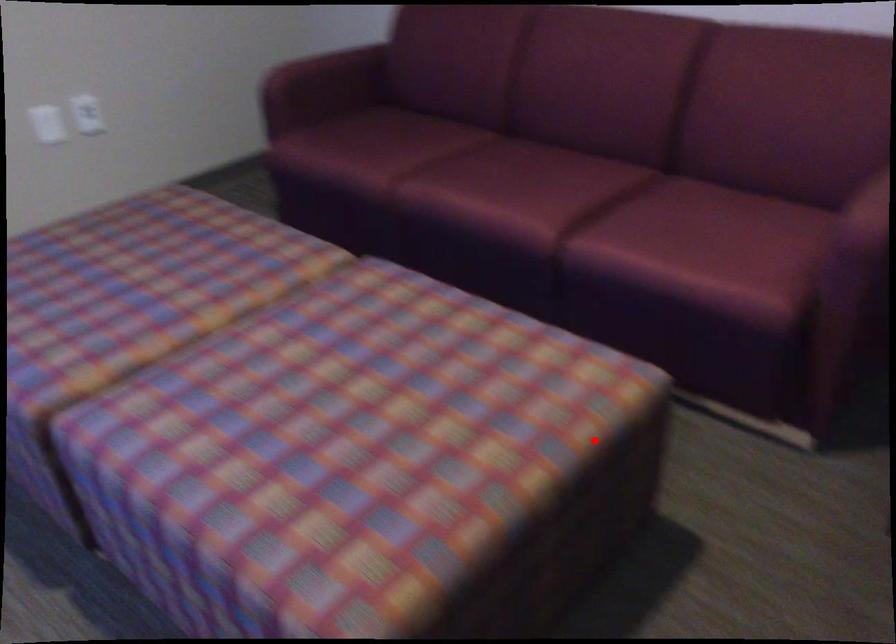
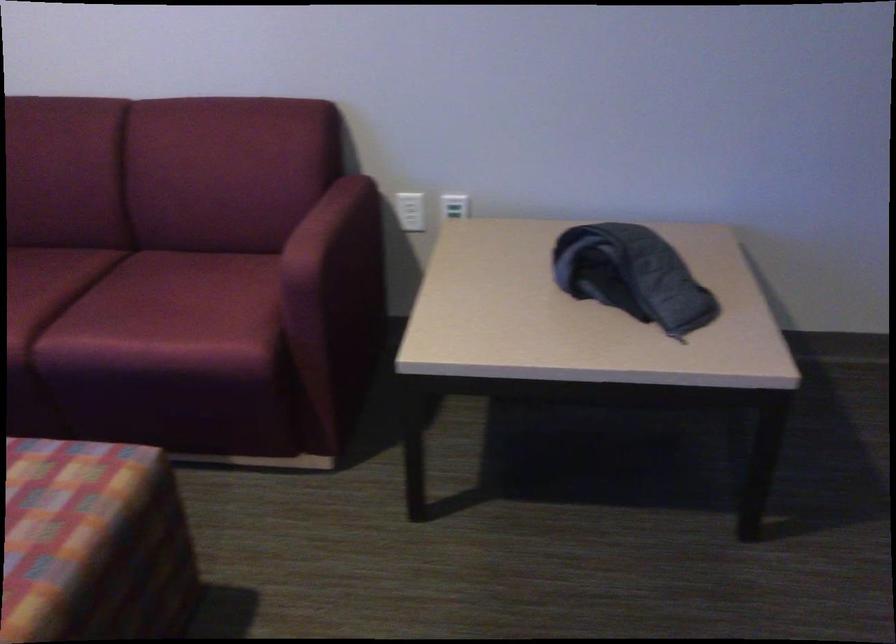
The point at the highlighted location is marked in the first image. Where is the corresponding point in the second image?

(93, 544)